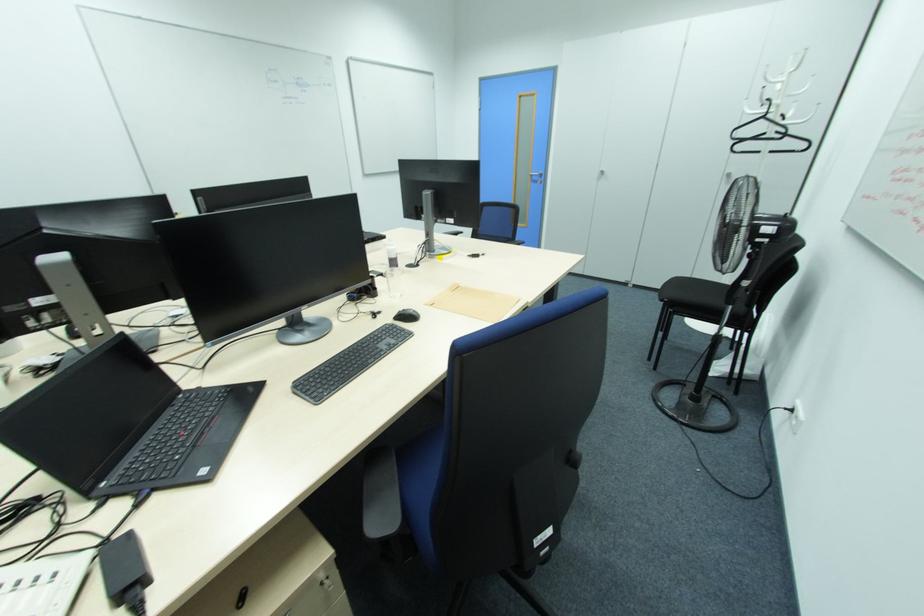
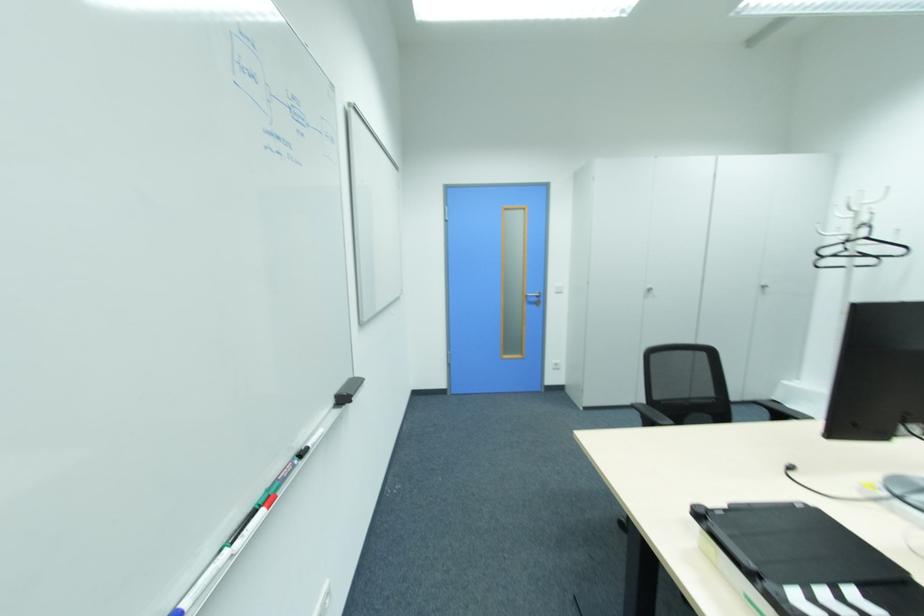
The point at (764, 118) is marked in the first image. Where is the corresponding point in the second image?

(865, 238)